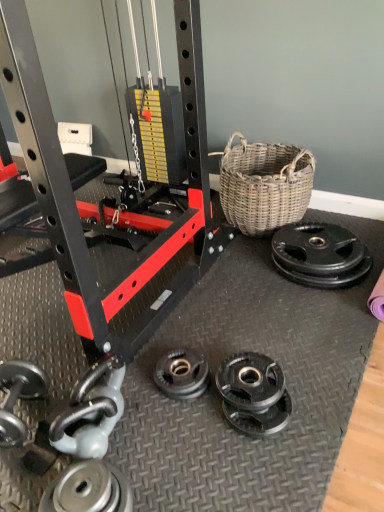
Question: Is point (122, 501) positioned closer to the camera than point (84, 439)?

Choices:
 (A) farther
 (B) closer

Answer: (B)

Question: Would you say silver metallic weight plate at lower left, the 2th wheel viewed from the back, is inside or outside silver metallic dumbbell at lower left?

Choices:
 (A) inside
 (B) outside

Answer: (B)

Question: Which of these objects is positioned farthest from the silver metallic dumbbell at lower left?

Choices:
 (A) woven natural basket at right
 (B) silver metallic weight plate at lower left, the 2th wheel viewed from the back
 (C) black rubber weight plate at right, the second wheel positioned from the bottom

Answer: (A)

Question: Considering the real-world distances, which object is farthest from the woven natural basket at right?

Choices:
 (A) silver metallic dumbbell at lower left
 (B) silver metallic weight plate at lower left, the first wheel positioned from the left
 (C) black rubber weight plate at right, placed as the 1th wheel when sorted from top to bottom

Answer: (B)